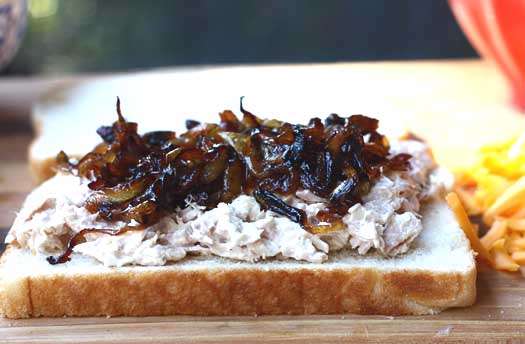
Locate an element on the screen. This screenshot has height=344, width=525. possibly a green plant is located at coordinates (46, 18).